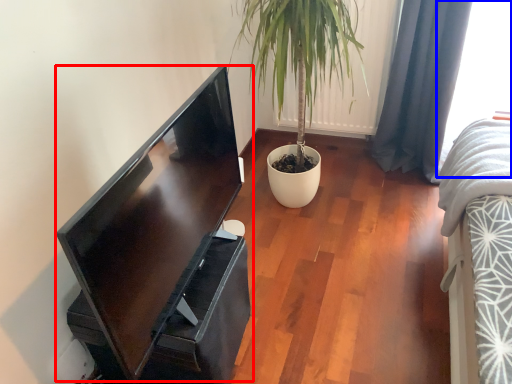
Question: Which point is further to the camera, computer monitor (highlighted by a red box) or window (highlighted by a blue box)?

Choices:
 (A) computer monitor
 (B) window

Answer: (B)